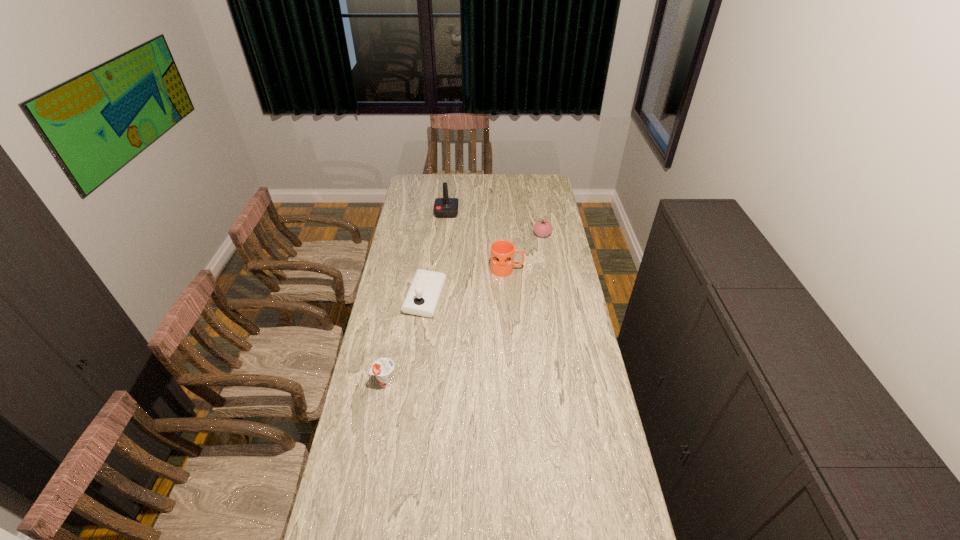
Image resolution: width=960 pixels, height=540 pixels. In order to click on object that ranks as the closest to the third nearest object in this screenshot , I will do `click(542, 228)`.

Where is `vacant position in the image that satisfies the following two spatial constraints: 1. on the back side of the tallest object; 2. on the left side of the nearest object`? vacant position in the image that satisfies the following two spatial constraints: 1. on the back side of the tallest object; 2. on the left side of the nearest object is located at coordinates (418, 213).